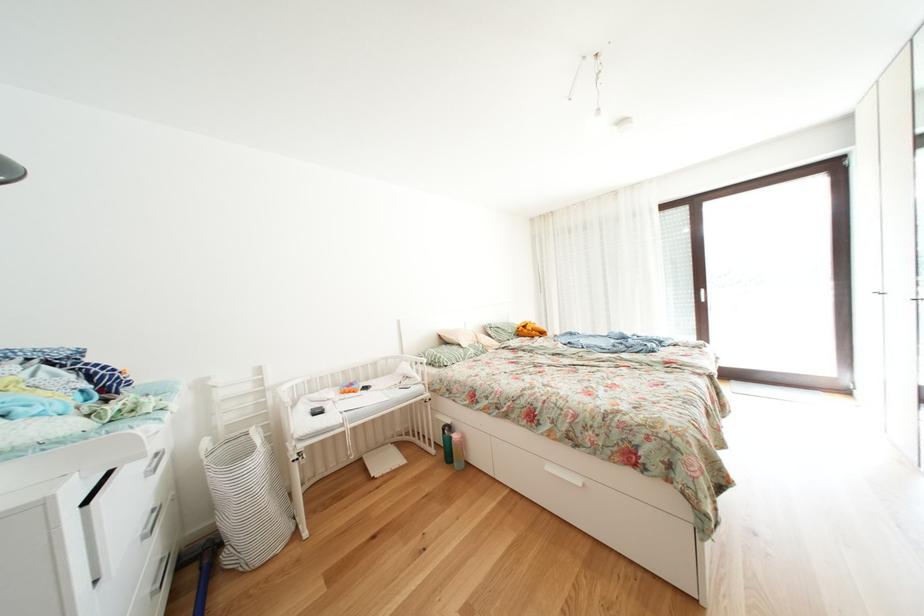
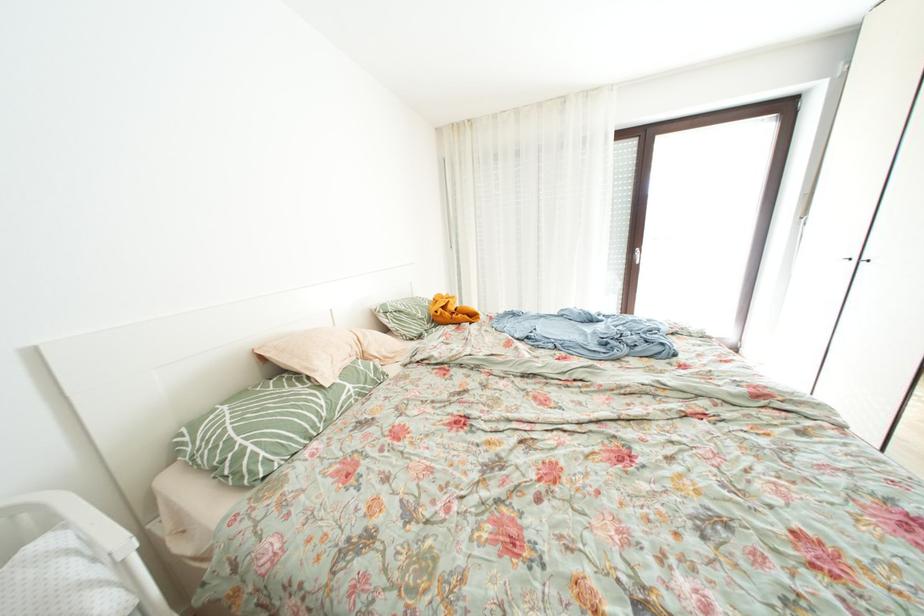
Question: In a continuous first-person perspective shot, in which direction is the camera moving?

Choices:
 (A) Left
 (B) Right
 (C) Forward
 (D) Backward

Answer: (C)